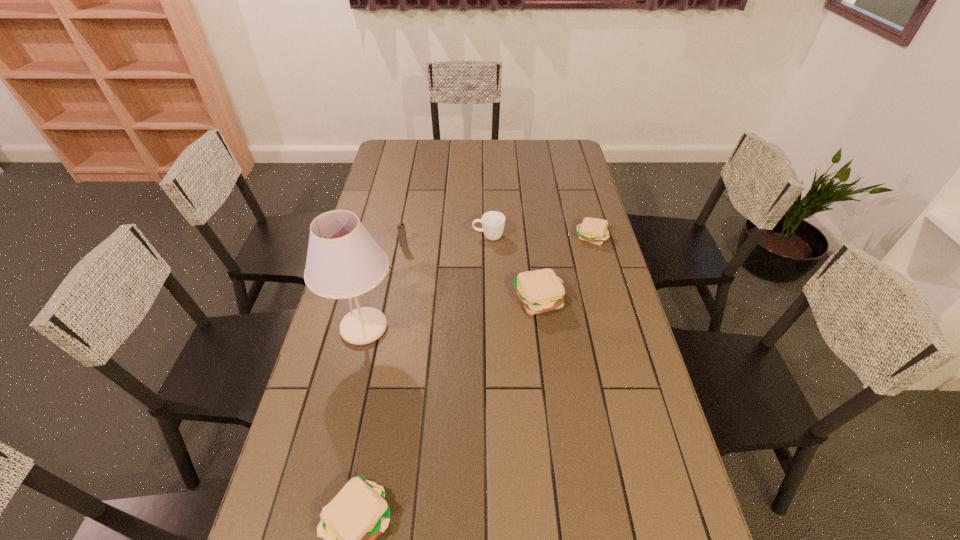
Find the location of `the fifth object from left to right`. the fifth object from left to right is located at coordinates (539, 291).

You are a GUI agent. You are given a task and a screenshot of the screen. Output one action in this format:
    pyautogui.click(x=<x>, y=<y>)
    Task: Click on the second nearest patty
    
    Given the screenshot: What is the action you would take?
    pyautogui.click(x=539, y=291)

The height and width of the screenshot is (540, 960). Identify the location of the rightmost patty. (592, 230).

At what (x,y) coordinates should I click in order to perform the action: click on the rightmost object. Please return your answer as a coordinate pair (x, y). Image resolution: width=960 pixels, height=540 pixels. Looking at the image, I should click on (592, 230).

This screenshot has height=540, width=960. In order to click on cup in this screenshot , I will do `click(493, 222)`.

This screenshot has width=960, height=540. Identify the location of igniter. (401, 226).

Identify the location of lampshade. (343, 261).

Where is `free space located 0.060m on the front of the fifth object from left to right`? This screenshot has width=960, height=540. free space located 0.060m on the front of the fifth object from left to right is located at coordinates (542, 338).

Where is `vacant area situated 0.280m on the front of the farthest patty`? The image size is (960, 540). vacant area situated 0.280m on the front of the farthest patty is located at coordinates (610, 306).

The image size is (960, 540). In order to click on vacant space located with the handle on the side of the cup in this screenshot , I will do `click(386, 237)`.